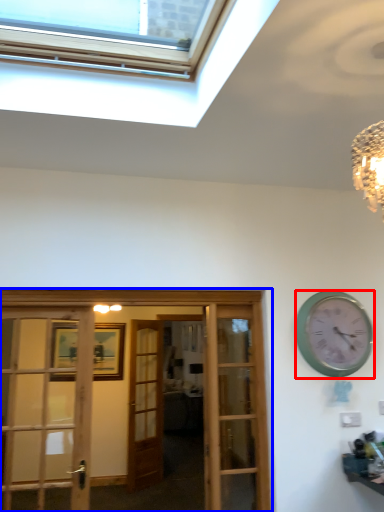
Question: Which of the following is the farthest to the observer, clock (highlighted by a red box) or hotel lobby (highlighted by a blue box)?

Choices:
 (A) clock
 (B) hotel lobby

Answer: (A)